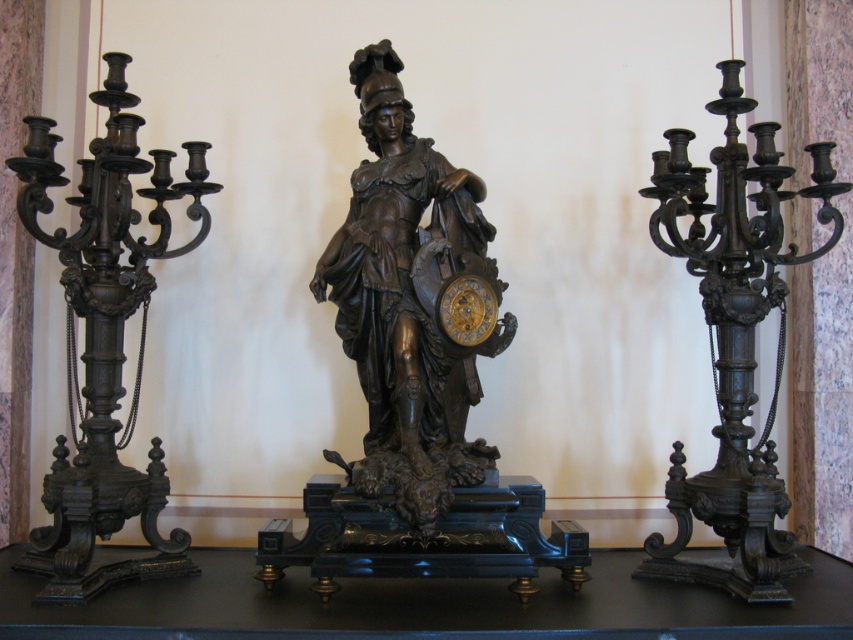
You are an interior designer assessing the proportions of the room. Given that the bronze statue at center and the matte black candelabra at right are part of the decor, which object would cast a longer shadow if the light source is directly above them?

The bronze statue at center is taller than the matte black candelabra at right, so it would cast a longer shadow when illuminated from above.

You are standing in front of the statue and want to place a small bouquet of flowers between the polished bronze candelabra at left and the gold polished metal clock at center. Which object should you place the bouquet closer to if you want it to be nearer to the viewer?

You should place the bouquet closer to the polished bronze candelabra at left because it is closer to the viewer than the gold polished metal clock at center.

In the scene shown: You are an interior designer assessing the spatial arrangement of the central statue and its surroundings. The polished bronze candelabra at left and the gold polished metal clock at center are both part of the design. Which object occupies more horizontal space in the composition?

The polished bronze candelabra at left is wider than the gold polished metal clock at center, so it occupies more horizontal space in the composition.